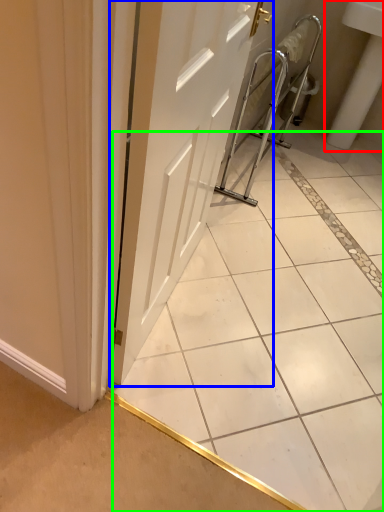
Question: Estimate the real-world distances between objects in this image. Which object is closer to sink (highlighted by a red box), door (highlighted by a blue box) or ceramic tile (highlighted by a green box)?

Choices:
 (A) door
 (B) ceramic tile

Answer: (B)